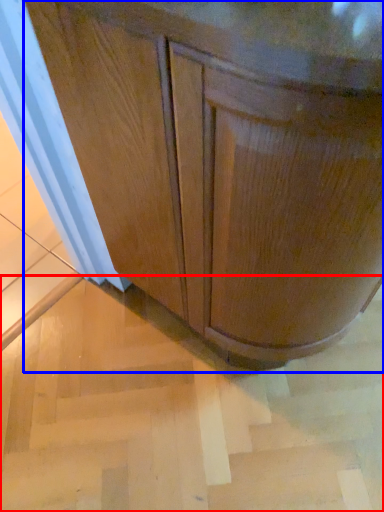
Question: Which point is further to the camera, stair (highlighted by a red box) or cabinetry (highlighted by a blue box)?

Choices:
 (A) stair
 (B) cabinetry

Answer: (A)